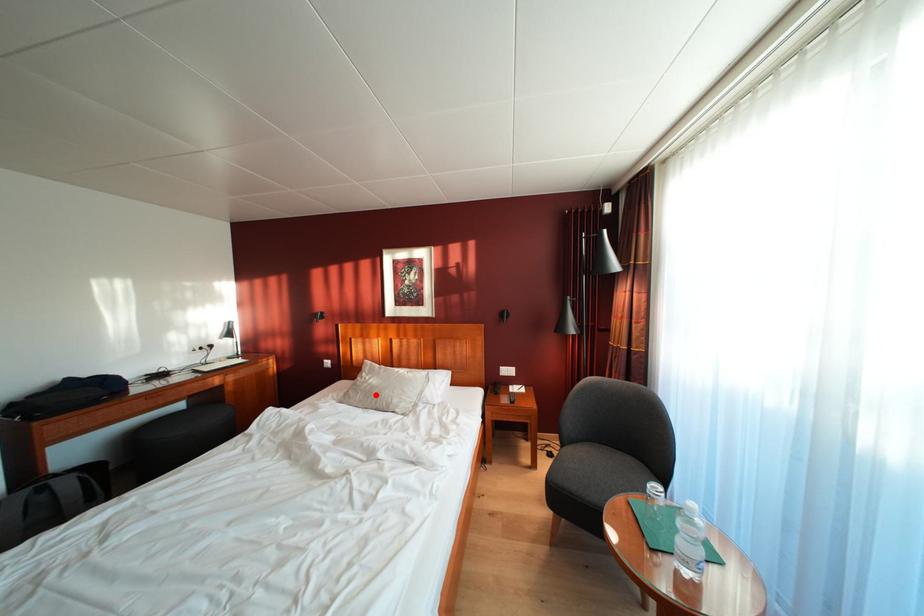
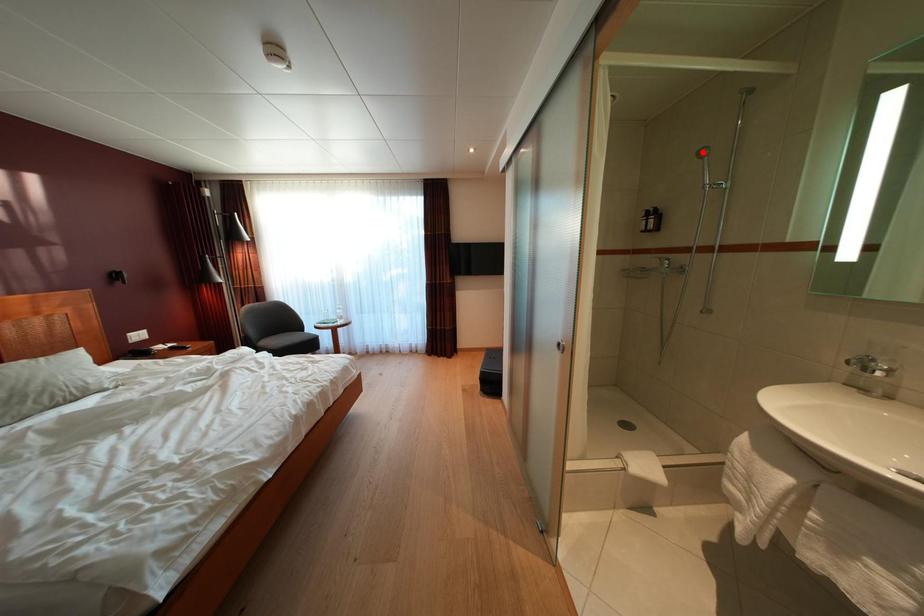
I am providing you with two images of the same scene from different viewpoints. A red point is marked on the first image and another point is marked on the second image. Do the highlighted points in image1 and image2 indicate the same real-world spot?

No